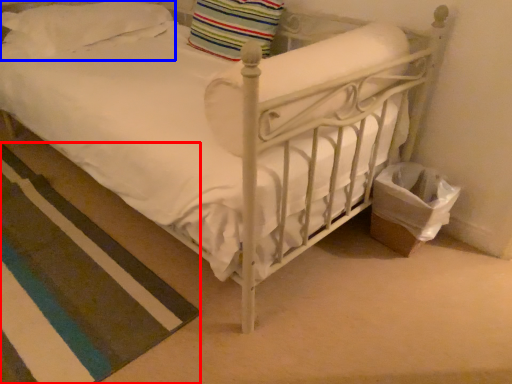
Question: Among these objects, which one is nearest to the camera, strip (highlighted by a red box) or pillow (highlighted by a blue box)?

Choices:
 (A) strip
 (B) pillow

Answer: (A)